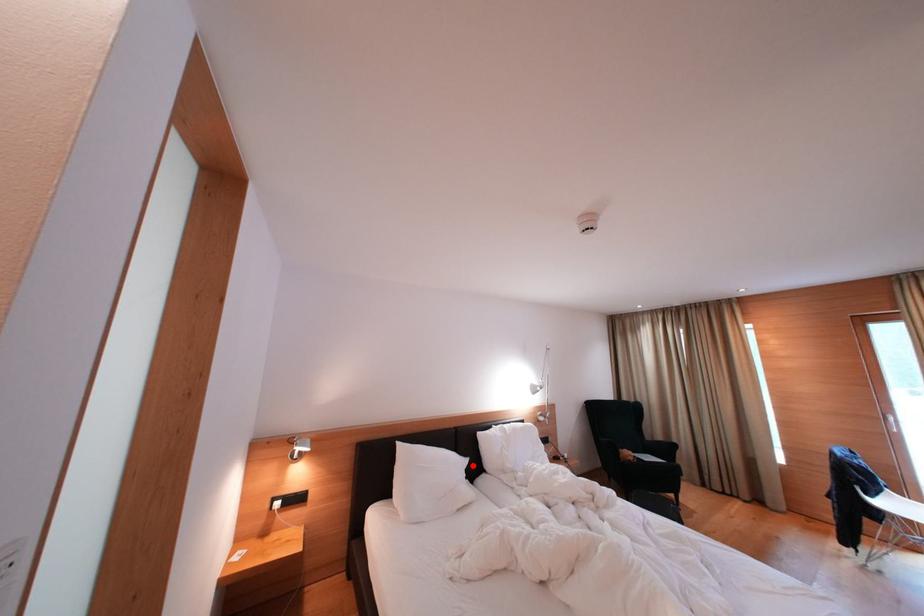
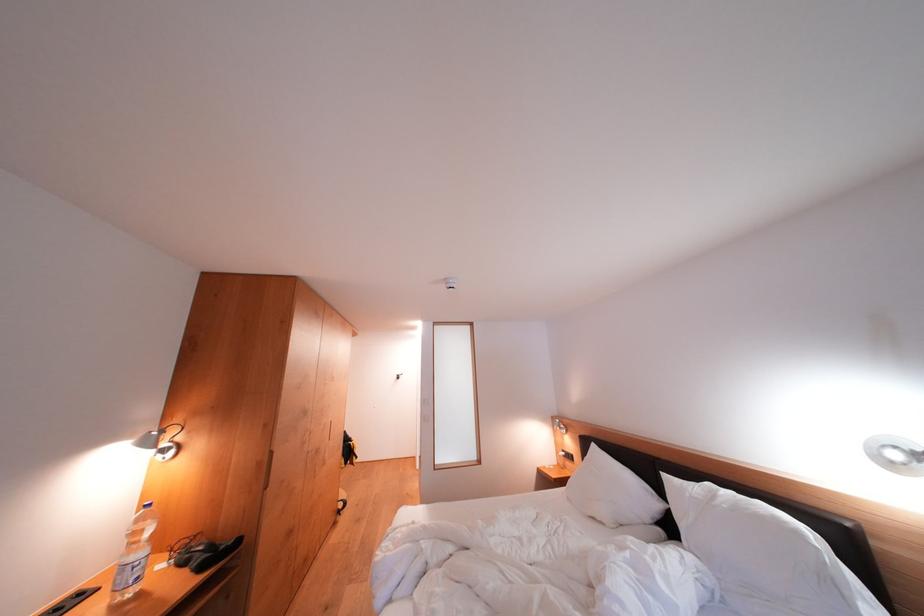
Question: I am providing you with two images of the same scene from different viewpoints. In image1, a red point is highlighted. Considering the same 3D point in image2, which of the following is correct?

Choices:
 (A) It is closer
 (B) It is farther

Answer: (A)